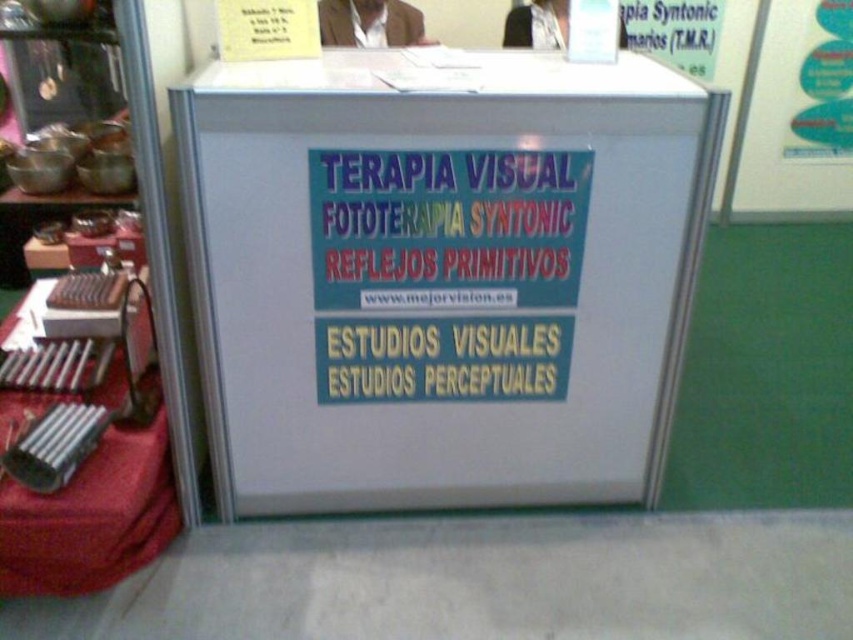
Does point (9, 502) come farther from viewer compared to point (791, 182)?

That is False.

Who is more forward, (109, 388) or (772, 182)?

Positioned in front is point (109, 388).

This screenshot has width=853, height=640. What are the coordinates of `metallic silver table at lower left` in the screenshot? It's located at (84, 452).

Who is shorter, white metallic sign at center or white paper at upper right?

white paper at upper right

Identify the location of white metallic sign at center. (440, 275).

Between white metallic sign at center and metallic silver table at lower left, which one is positioned higher?

Positioned higher is white metallic sign at center.

Can you confirm if white metallic sign at center is positioned above metallic silver table at lower left?

Yes, white metallic sign at center is above metallic silver table at lower left.

Between point (554, 122) and point (26, 508), which one is positioned in front?

Point (26, 508)

Where is `white metallic sign at center`? white metallic sign at center is located at coordinates (440, 275).